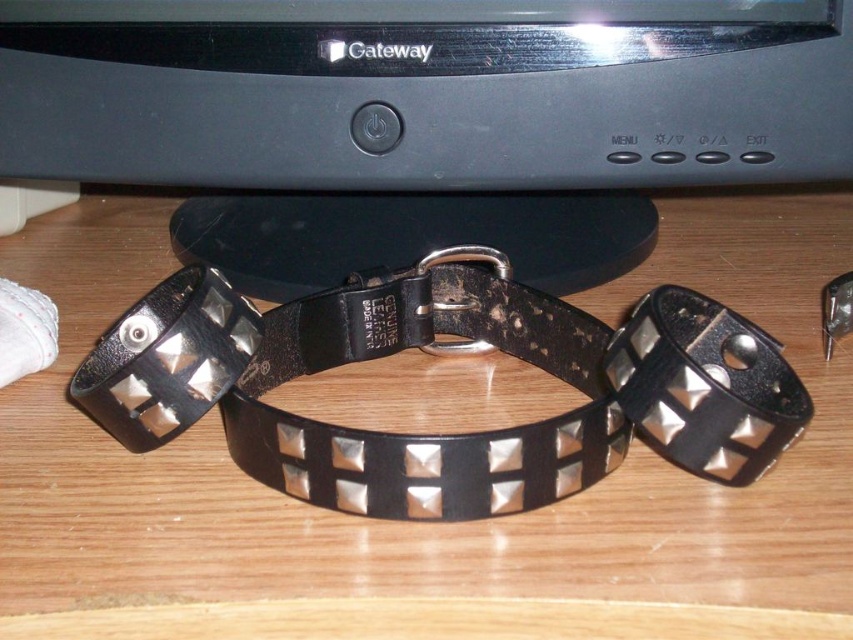
Which is above, wooden desk at center or black leather studded bracelet at center?

wooden desk at center is above.

Find the location of a particular element. This screenshot has width=853, height=640. wooden desk at center is located at coordinates (426, 524).

Between point (68, 259) and point (721, 467), which one is positioned in front?

Point (721, 467)

You are a GUI agent. You are given a task and a screenshot of the screen. Output one action in this format:
    pyautogui.click(x=<x>, y=<y>)
    Task: Click on the wooden desk at center
    This screenshot has height=640, width=853.
    Given the screenshot: What is the action you would take?
    pyautogui.click(x=426, y=524)

Is point (764, 326) more distant than point (601, 65)?

Yes, it is.

Is wooden desk at center below black plastic monitor at center?

Yes.

Is point (402, 595) farther from viewer compared to point (126, 70)?

That is False.

This screenshot has width=853, height=640. I want to click on wooden desk at center, so 426,524.

Can you confirm if black leather studded bracelet at center is wider than black leather bracelet at center?

Incorrect, black leather studded bracelet at center's width does not surpass black leather bracelet at center's.

Is black leather studded bracelet at center to the right of black leather bracelet at center from the viewer's perspective?

Yes, black leather studded bracelet at center is to the right of black leather bracelet at center.

Between point (726, 371) and point (244, 324), which one is positioned in front?

Positioned in front is point (244, 324).

Locate an element on the screen. black leather studded bracelet at center is located at coordinates (705, 385).